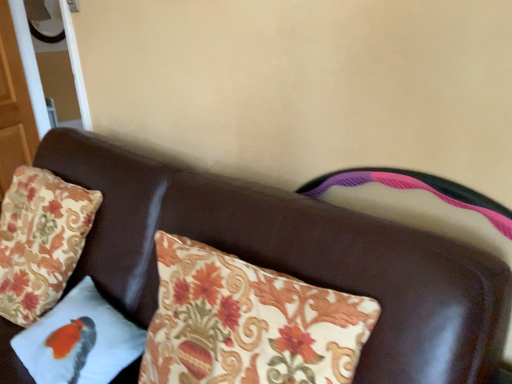
The width and height of the screenshot is (512, 384). Identify the location of floral fabric pillow at left, arranged as the 1th pillow when viewed from the left. (40, 241).

The image size is (512, 384). What do you see at coordinates (79, 340) in the screenshot?
I see `white fabric pillow with bird design at lower left, positioned as the first pillow in right-to-left order` at bounding box center [79, 340].

Locate an element on the screen. This screenshot has width=512, height=384. brown leather couch at center is located at coordinates (292, 257).

What do you see at coordinates (292, 257) in the screenshot?
I see `brown leather couch at center` at bounding box center [292, 257].

Where is `floral fabric pillow at left, arranged as the 1th pillow when viewed from the left`? The width and height of the screenshot is (512, 384). floral fabric pillow at left, arranged as the 1th pillow when viewed from the left is located at coordinates (40, 241).

Considering the relative sizes of floral fabric pillow at left, arranged as the 1th pillow when viewed from the left, and white fabric pillow with bird design at lower left, the 2th pillow viewed from the left, in the image provided, is floral fabric pillow at left, arranged as the 1th pillow when viewed from the left, wider than white fabric pillow with bird design at lower left, the 2th pillow viewed from the left,?

Yes.

Is point (21, 257) positioned behind point (101, 338)?

Yes, it is.

Based on their sizes in the image, would you say white fabric pillow with bird design at lower left, the 2th pillow viewed from the left, is bigger or smaller than brown leather couch at center?

Clearly, white fabric pillow with bird design at lower left, the 2th pillow viewed from the left, is smaller in size than brown leather couch at center.

Is white fabric pillow with bird design at lower left, positioned as the first pillow in right-to-left order, aimed at brown leather couch at center?

Yes, white fabric pillow with bird design at lower left, positioned as the first pillow in right-to-left order, faces towards brown leather couch at center.

From a real-world perspective, who is located higher, white fabric pillow with bird design at lower left, the 2th pillow viewed from the left, or brown leather couch at center?

white fabric pillow with bird design at lower left, the 2th pillow viewed from the left, from a real-world perspective.

Considering the sizes of white fabric pillow with bird design at lower left, the 2th pillow viewed from the left, and brown leather couch at center in the image, is white fabric pillow with bird design at lower left, the 2th pillow viewed from the left, wider or thinner than brown leather couch at center?

white fabric pillow with bird design at lower left, the 2th pillow viewed from the left, is thinner than brown leather couch at center.

From the image's perspective, which object appears higher, brown leather couch at center or floral fabric pillow at left, arranged as the 1th pillow when viewed from the left?

From the image's view, floral fabric pillow at left, arranged as the 1th pillow when viewed from the left, is above.

Can you see brown leather couch at center touching floral fabric pillow at left, which is counted as the 2th pillow, starting from the right?

brown leather couch at center and floral fabric pillow at left, which is counted as the 2th pillow, starting from the right, are clearly separated.

Does point (113, 153) lie behind point (11, 214)?

No, it is not.

How different are the orientations of brown leather couch at center and white fabric pillow with bird design at lower left, the 2th pillow viewed from the left, in degrees?

1.01 degrees separate the facing orientations of brown leather couch at center and white fabric pillow with bird design at lower left, the 2th pillow viewed from the left.

Is brown leather couch at center looking in the opposite direction of white fabric pillow with bird design at lower left, positioned as the first pillow in right-to-left order?

Yes, brown leather couch at center is facing away from white fabric pillow with bird design at lower left, positioned as the first pillow in right-to-left order.

Is brown leather couch at center further to camera compared to white fabric pillow with bird design at lower left, the 2th pillow viewed from the left?

No, brown leather couch at center is in front of white fabric pillow with bird design at lower left, the 2th pillow viewed from the left.

Is brown leather couch at center positioned beyond the bounds of white fabric pillow with bird design at lower left, the 2th pillow viewed from the left?

brown leather couch at center lies outside white fabric pillow with bird design at lower left, the 2th pillow viewed from the left,'s area.

Considering the sizes of objects floral fabric pillow at left, arranged as the 1th pillow when viewed from the left, and brown leather couch at center in the image provided, who is thinner, floral fabric pillow at left, arranged as the 1th pillow when viewed from the left, or brown leather couch at center?

floral fabric pillow at left, arranged as the 1th pillow when viewed from the left, is thinner.

Does floral fabric pillow at left, which is counted as the 2th pillow, starting from the right, come behind brown leather couch at center?

Yes, floral fabric pillow at left, which is counted as the 2th pillow, starting from the right, is behind brown leather couch at center.

Looking at this image, is floral fabric pillow at left, which is counted as the 2th pillow, starting from the right, next to brown leather couch at center?

No, floral fabric pillow at left, which is counted as the 2th pillow, starting from the right, is not beside brown leather couch at center.

The image size is (512, 384). Find the location of `pillow that appears below the floral fabric pillow at left, which is counted as the 2th pillow, starting from the right (from the image's perspective)`. pillow that appears below the floral fabric pillow at left, which is counted as the 2th pillow, starting from the right (from the image's perspective) is located at coordinates [x=79, y=340].

Which of these two, white fabric pillow with bird design at lower left, positioned as the first pillow in right-to-left order, or floral fabric pillow at left, arranged as the 1th pillow when viewed from the left, is bigger?

floral fabric pillow at left, arranged as the 1th pillow when viewed from the left.

Based on their positions, is white fabric pillow with bird design at lower left, positioned as the first pillow in right-to-left order, located to the left or right of floral fabric pillow at left, which is counted as the 2th pillow, starting from the right?

In the image, white fabric pillow with bird design at lower left, positioned as the first pillow in right-to-left order, appears on the right side of floral fabric pillow at left, which is counted as the 2th pillow, starting from the right.

At what (x,y) coordinates should I click in order to perform the action: click on pillow behind the white fabric pillow with bird design at lower left, positioned as the first pillow in right-to-left order. Please return your answer as a coordinate pair (x, y). This screenshot has width=512, height=384. Looking at the image, I should click on (40, 241).

In the image, there is a white fabric pillow with bird design at lower left, the 2th pillow viewed from the left. Identify the location of furniture below it (from a real-world perspective). (292, 257).

Looking at this image, based on their spatial positions, is floral fabric pillow at left, arranged as the 1th pillow when viewed from the left, or white fabric pillow with bird design at lower left, the 2th pillow viewed from the left, closer to brown leather couch at center?

The object closer to brown leather couch at center is white fabric pillow with bird design at lower left, the 2th pillow viewed from the left.

Based on their spatial positions, is floral fabric pillow at left, arranged as the 1th pillow when viewed from the left, or brown leather couch at center closer to white fabric pillow with bird design at lower left, the 2th pillow viewed from the left?

Among the two, brown leather couch at center is located nearer to white fabric pillow with bird design at lower left, the 2th pillow viewed from the left.

Which object lies nearer to the anchor point white fabric pillow with bird design at lower left, the 2th pillow viewed from the left, brown leather couch at center or floral fabric pillow at left, arranged as the 1th pillow when viewed from the left?

brown leather couch at center is closer to white fabric pillow with bird design at lower left, the 2th pillow viewed from the left.

Based on their spatial positions, is white fabric pillow with bird design at lower left, the 2th pillow viewed from the left, or brown leather couch at center further from floral fabric pillow at left, which is counted as the 2th pillow, starting from the right?

brown leather couch at center is positioned further to the anchor floral fabric pillow at left, which is counted as the 2th pillow, starting from the right.

Estimate the real-world distances between objects in this image. Which object is closer to brown leather couch at center, white fabric pillow with bird design at lower left, positioned as the first pillow in right-to-left order, or floral fabric pillow at left, arranged as the 1th pillow when viewed from the left?

white fabric pillow with bird design at lower left, positioned as the first pillow in right-to-left order, lies closer to brown leather couch at center than the other object.

Estimate the real-world distances between objects in this image. Which object is further from floral fabric pillow at left, which is counted as the 2th pillow, starting from the right, brown leather couch at center or white fabric pillow with bird design at lower left, the 2th pillow viewed from the left?

brown leather couch at center.

The width and height of the screenshot is (512, 384). In order to click on pillow between brown leather couch at center and floral fabric pillow at left, arranged as the 1th pillow when viewed from the left, in the front-back direction in this screenshot , I will do `click(79, 340)`.